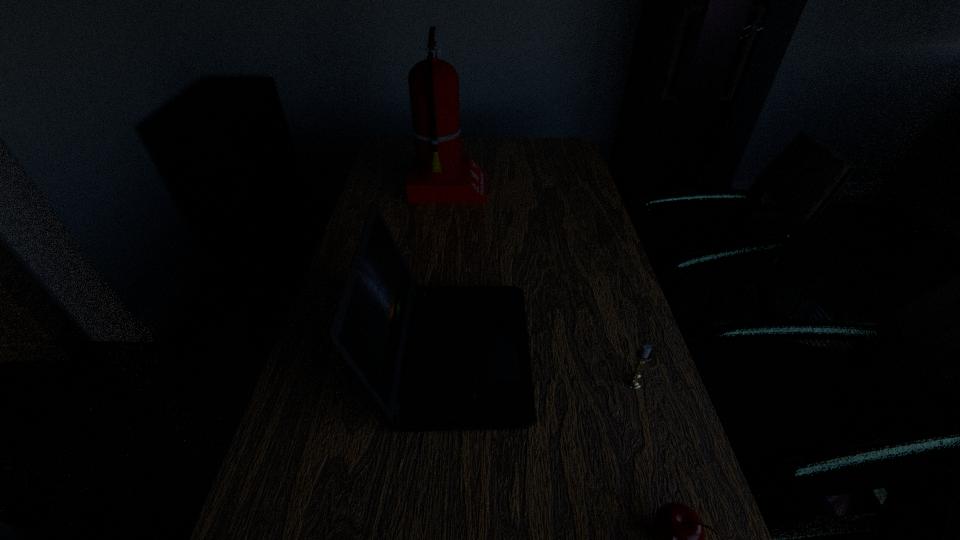
This screenshot has height=540, width=960. What are the coordinates of `vacant space that's between the farthest object and the candle holder` in the screenshot? It's located at (541, 286).

Locate an element on the screen. The image size is (960, 540). free space between the second tallest object and the fire extinguisher is located at coordinates (451, 272).

At what (x,y) coordinates should I click in order to perform the action: click on the closest object to the second shortest object. Please return your answer as a coordinate pair (x, y). This screenshot has width=960, height=540. Looking at the image, I should click on (434, 358).

Select which object is the third closest to the candle holder. Please provide its 2D coordinates. Your answer should be formatted as a tuple, i.e. [(x, y)], where the tuple contains the x and y coordinates of a point satisfying the conditions above.

[(438, 174)]

Find the location of a particular element. The image size is (960, 540). free space that satisfies the following two spatial constraints: 1. on the back side of the candle holder; 2. on the screen of the laptop_computer is located at coordinates (624, 353).

Locate an element on the screen. The width and height of the screenshot is (960, 540). vacant space that satisfies the following two spatial constraints: 1. on the back side of the second shortest object; 2. on the screen of the laptop_computer is located at coordinates (624, 353).